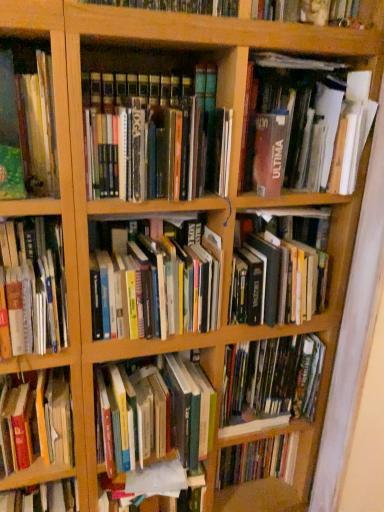
Question: Is green matte book at left, positioned as the 8th book in bottom-to-top order, surrounded by matte brown book at upper right, which is counted as the first book, starting from the top?

Choices:
 (A) yes
 (B) no

Answer: (B)

Question: Does matte brown book at upper right, the ninth book ordered from the bottom, appear on the right side of green matte book at left, the second book in the top-to-bottom sequence?

Choices:
 (A) no
 (B) yes

Answer: (B)

Question: From the image's perspective, is matte brown book at upper right, which is counted as the first book, starting from the top, located beneath green matte book at left, the second book in the top-to-bottom sequence?

Choices:
 (A) no
 (B) yes

Answer: (A)

Question: Is matte brown book at upper right, which is counted as the first book, starting from the top, closer to camera compared to green matte book at left, positioned as the 8th book in bottom-to-top order?

Choices:
 (A) yes
 (B) no

Answer: (B)

Question: Can you confirm if matte brown book at upper right, the ninth book ordered from the bottom, is shorter than green matte book at left, positioned as the 8th book in bottom-to-top order?

Choices:
 (A) no
 (B) yes

Answer: (A)

Question: In terms of height, does matte brown book at upper right, the ninth book ordered from the bottom, look taller or shorter compared to hardcover books at center, which is the 2th book in bottom-to-top order?

Choices:
 (A) short
 (B) tall

Answer: (B)

Question: Is matte brown book at upper right, which is counted as the first book, starting from the top, to the left or to the right of hardcover books at center, which is the 2th book in bottom-to-top order, in the image?

Choices:
 (A) right
 (B) left

Answer: (A)

Question: Is matte brown book at upper right, which is counted as the first book, starting from the top, bigger or smaller than hardcover books at center, which is the 2th book in bottom-to-top order?

Choices:
 (A) small
 (B) big

Answer: (B)

Question: Is matte brown book at upper right, the ninth book ordered from the bottom, inside the boundaries of hardcover books at center, positioned as the 8th book in top-to-bottom order, or outside?

Choices:
 (A) inside
 (B) outside

Answer: (B)

Question: From the image's perspective, is hardcover book at left, the 1th book ordered from the bottom, above or below hardcover book at left, which appears as the 6th book when viewed from the top?

Choices:
 (A) below
 (B) above

Answer: (A)

Question: Is hardcover book at left, the 1th book ordered from the bottom, in front of or behind hardcover book at left, which is counted as the 4th book, starting from the bottom, in the image?

Choices:
 (A) behind
 (B) front

Answer: (A)

Question: From a real-world perspective, is hardcover book at left, the 9th book in the top-to-bottom sequence, above or below hardcover book at left, which appears as the 6th book when viewed from the top?

Choices:
 (A) below
 (B) above

Answer: (A)

Question: Visually, is hardcover book at left, the 9th book in the top-to-bottom sequence, positioned to the left or to the right of hardcover book at left, which appears as the 6th book when viewed from the top?

Choices:
 (A) left
 (B) right

Answer: (A)

Question: Looking at the image, does hardcover book at left, which is counted as the 4th book, starting from the bottom, seem bigger or smaller compared to hardcover books at center, positioned as the 8th book in top-to-bottom order?

Choices:
 (A) big
 (B) small

Answer: (B)

Question: Is hardcover book at left, which appears as the 6th book when viewed from the top, in front of or behind hardcover books at center, which is the 2th book in bottom-to-top order, in the image?

Choices:
 (A) behind
 (B) front

Answer: (B)